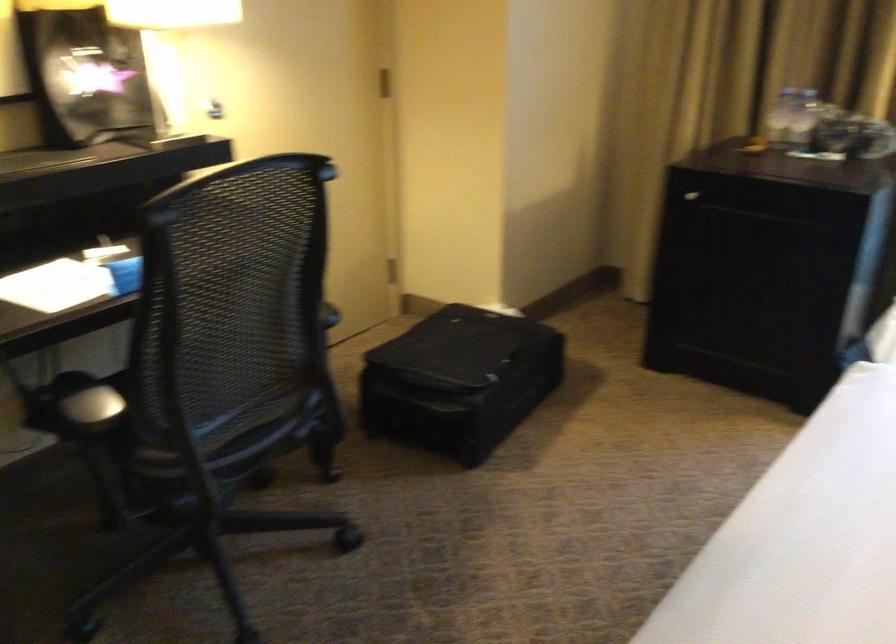
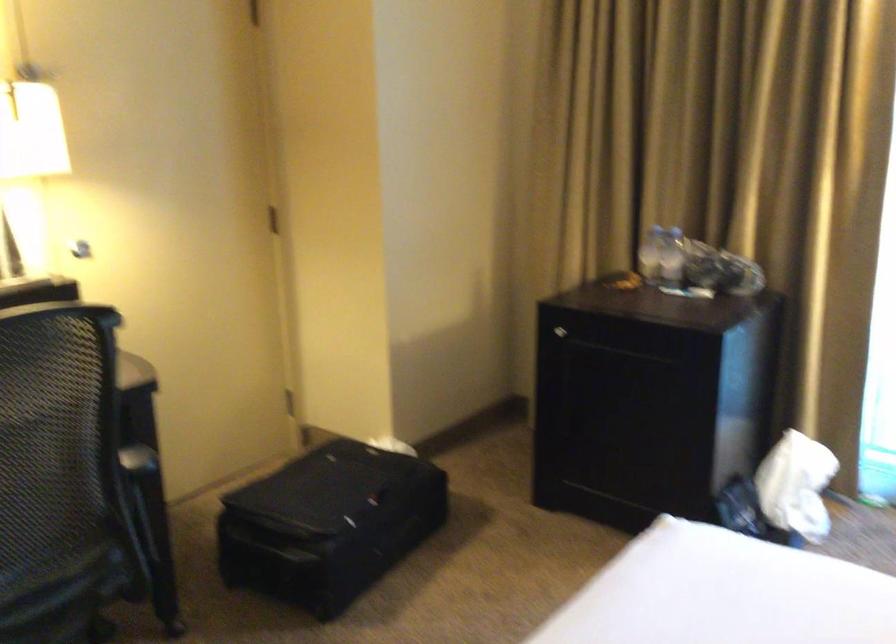
In the second image, find the point that corresponds to the point at 309,375 in the first image.

(136, 527)